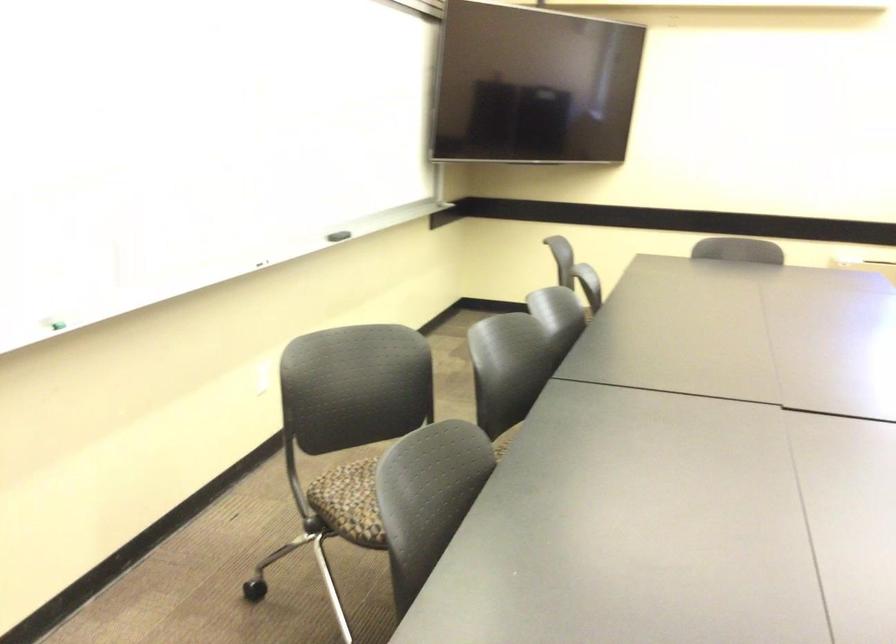
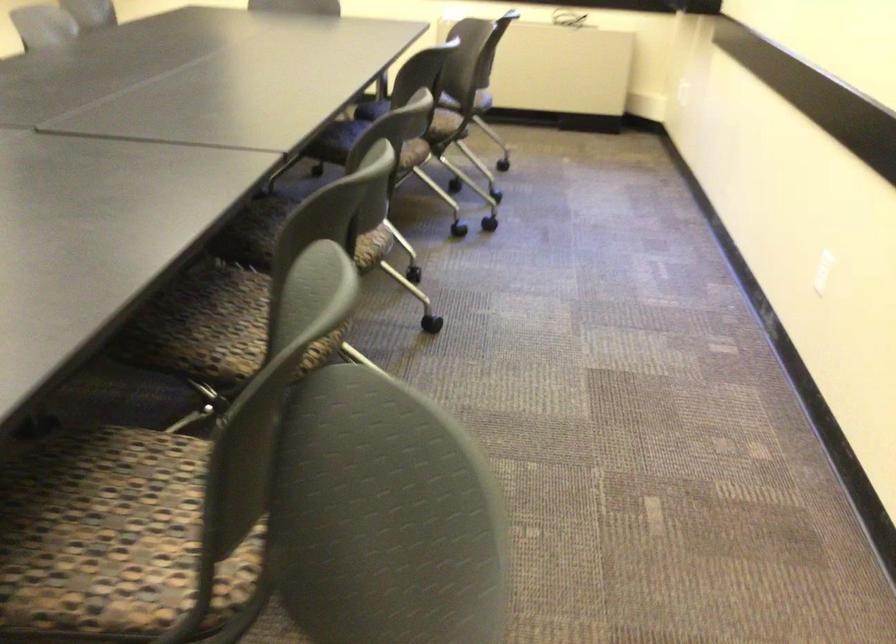
Question: Which direction would the cameraman need to move to produce the second image? Reply with the corresponding letter.

Choices:
 (A) Left
 (B) Right
 (C) Forward
 (D) Backward

Answer: (B)